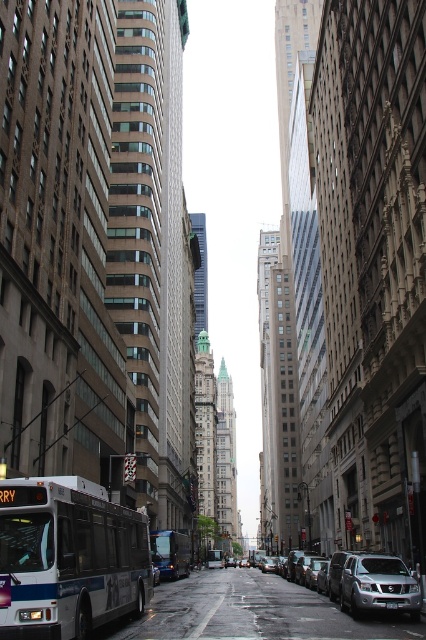
Which is more to the left, silver metallic suv at lower right or blue metallic bus at center?

blue metallic bus at center

Is silver metallic suv at lower right further to camera compared to blue metallic bus at center?

No, it is not.

At what (x,y) coordinates should I click in order to perform the action: click on silver metallic suv at lower right. Please return your answer as a coordinate pair (x, y). The image size is (426, 640). Looking at the image, I should click on (370, 582).

Is blue metallic bus at center positioned behind white metallic bus at center?

No, it is in front of white metallic bus at center.

Is point (160, 540) farther from viewer compared to point (219, 554)?

No, it is in front of (219, 554).

Is point (161, 531) positioned after point (218, 563)?

That is False.

What are the coordinates of `blue metallic bus at center` in the screenshot? It's located at (170, 554).

Does white metallic bus at lower left come in front of blue metallic bus at center?

That is True.

Who is lower down, white metallic bus at lower left or blue metallic bus at center?

blue metallic bus at center is below.

What do you see at coordinates (68, 557) in the screenshot? I see `white metallic bus at lower left` at bounding box center [68, 557].

Find the location of `white metallic bus at lower left`. white metallic bus at lower left is located at coordinates (68, 557).